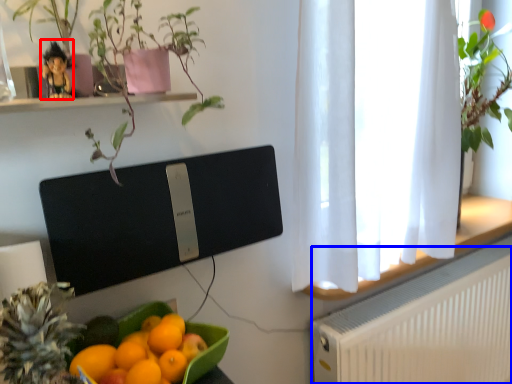
Question: Among these objects, which one is farthest to the camera, toy (highlighted by a red box) or radiator (highlighted by a blue box)?

Choices:
 (A) toy
 (B) radiator

Answer: (B)